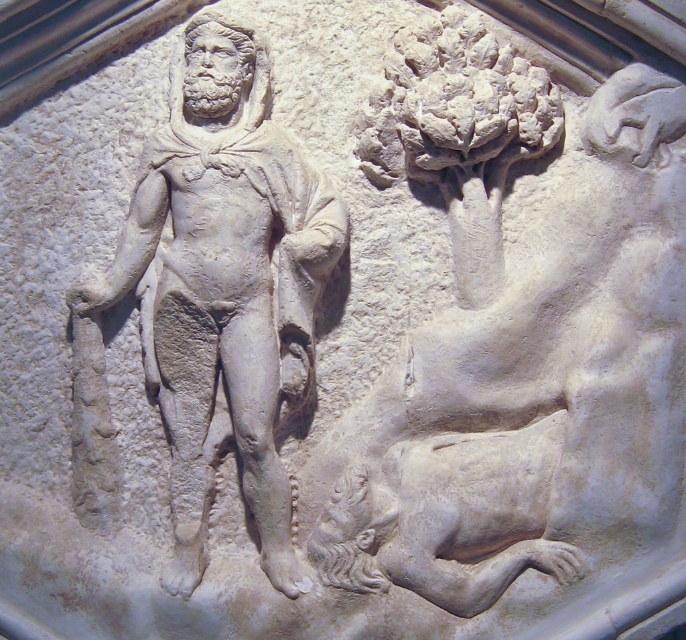
Based on the photo, you are an art conservator examining the classical relief sculpture. You need to measure the distance between the white stone tree at upper center and the camera to ensure proper lighting. What is the exact distance in feet?

The white stone tree at upper center is exactly 6.63 feet away from the camera.